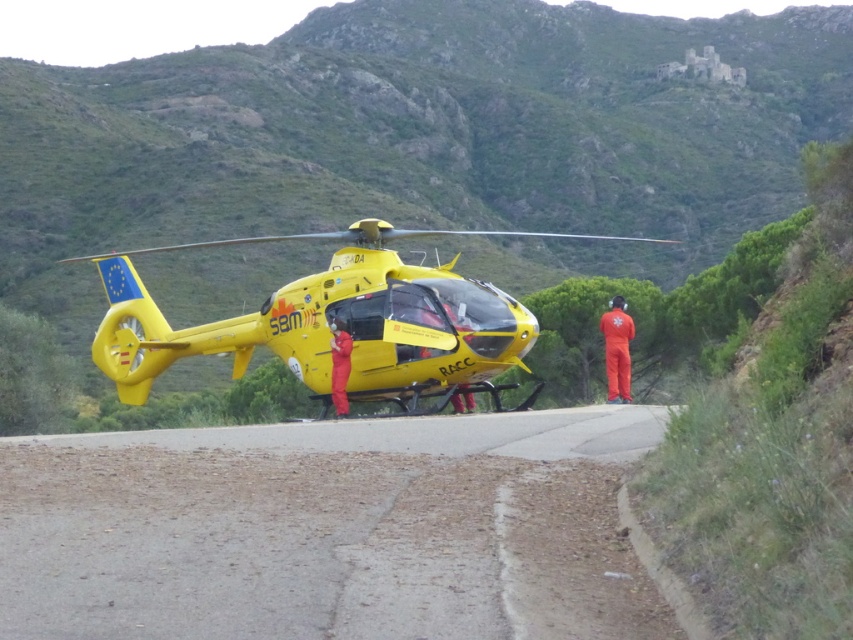
You are a pilot planning to land a helicopter on the narrow road where the yellow matte helicopter at center is parked. Based on the coordinates provided in the scene description, can you determine if there is enough space to safely land your helicopter?

The yellow matte helicopter at center is positioned at coordinates point (332, 317). However, without knowing the exact dimensions of the road and the required landing area for your helicopter, it is impossible to determine if there is sufficient space for a safe landing.